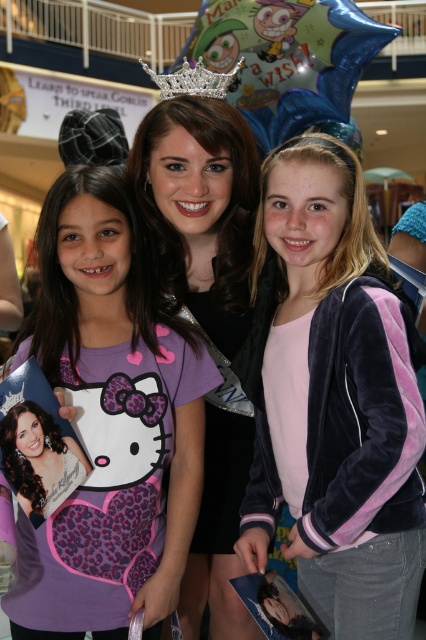
What do you see at coordinates (333, 397) in the screenshot? This screenshot has height=640, width=426. I see `velvet purple jacket at center` at bounding box center [333, 397].

Who is lower down, velvet purple jacket at center or matte black dress at center?

Positioned lower is matte black dress at center.

Is point (382, 339) positioned before point (207, 397)?

Yes, point (382, 339) is in front of point (207, 397).

The height and width of the screenshot is (640, 426). What are the coordinates of `velvet purple jacket at center` in the screenshot? It's located at (333, 397).

Is point (158, 340) positioned behind point (54, 508)?

Yes, point (158, 340) is behind point (54, 508).

What do you see at coordinates (111, 420) in the screenshot?
I see `purple matte shirt at center` at bounding box center [111, 420].

Measure the distance between point (175, 371) and camera.

The distance of point (175, 371) from camera is 3.91 meters.

This screenshot has height=640, width=426. What are the coordinates of `purple matte shirt at center` in the screenshot? It's located at (111, 420).

Which is more to the right, matte black photo at center or silver glittery tiara at upper center?

silver glittery tiara at upper center is more to the right.

Can you confirm if matte black photo at center is positioned above silver glittery tiara at upper center?

Incorrect, matte black photo at center is not positioned above silver glittery tiara at upper center.

The image size is (426, 640). Describe the element at coordinates (39, 458) in the screenshot. I see `matte black photo at center` at that location.

I want to click on matte black photo at center, so click(x=39, y=458).